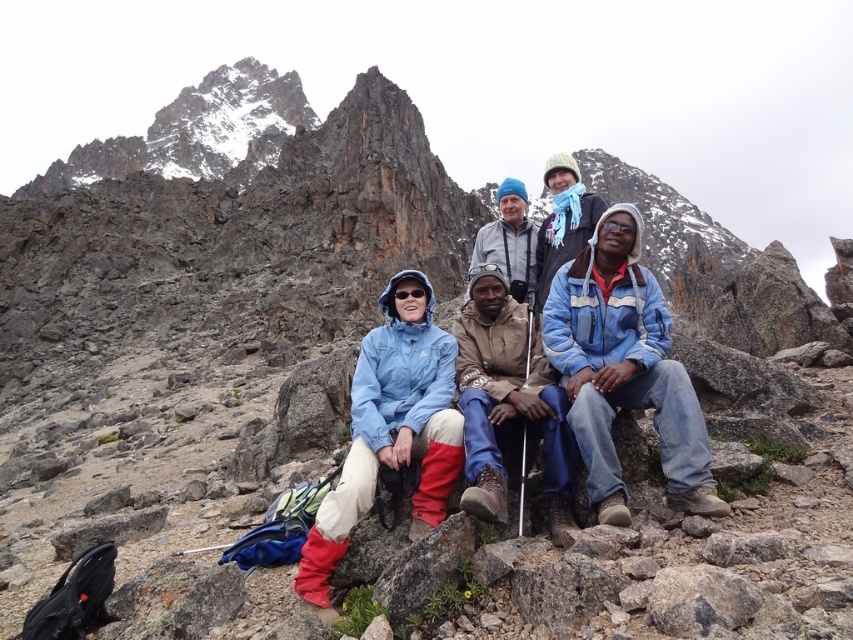
You are planning to take a photo of the group from the lower right position. Which jacket, the blue denim jacket at lower right or the brown suede jacket at center, will appear larger in the photo?

The blue denim jacket at lower right will appear larger in the photo because it is taller than the brown suede jacket at center.